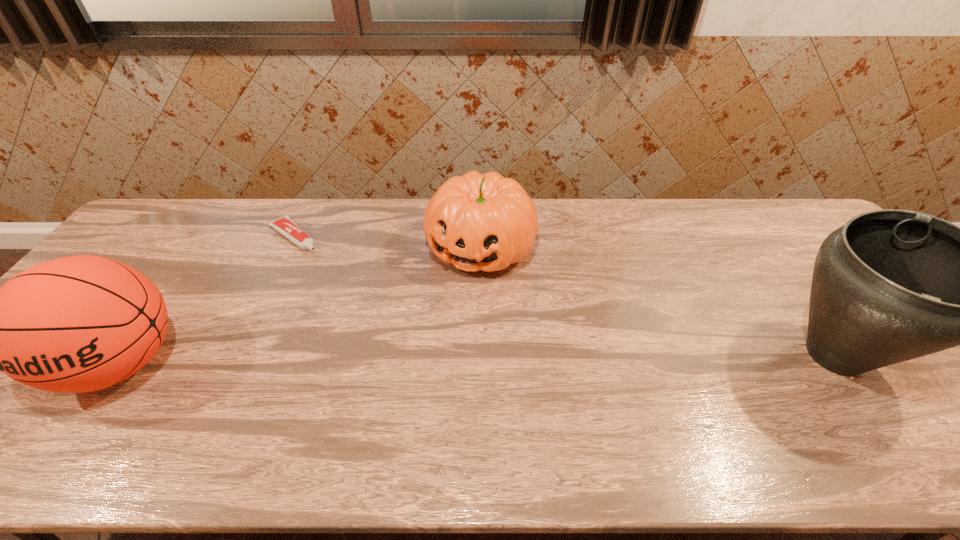
The height and width of the screenshot is (540, 960). I want to click on object that is at the near right corner, so click(891, 285).

In the image, there is a desktop. Identify the location of vacant space at the far edge. The image size is (960, 540). (301, 200).

This screenshot has height=540, width=960. In order to click on vacant region at the near edge of the desktop in this screenshot , I will do `click(280, 409)`.

Locate an element on the screen. The image size is (960, 540). vacant point located between the third object from left to right and the urn is located at coordinates (658, 301).

The image size is (960, 540). What are the coordinates of `vacant area that lies between the third tallest object and the rightmost object` in the screenshot? It's located at (658, 301).

Identify the location of empty space between the second object from right to left and the shortest object. The image size is (960, 540). (388, 242).

I want to click on vacant area that lies between the rightmost object and the leftmost object, so click(x=478, y=360).

At what (x,y) coordinates should I click in order to perform the action: click on free area in between the rightmost object and the leftmost object. Please return your answer as a coordinate pair (x, y). This screenshot has height=540, width=960. Looking at the image, I should click on (478, 360).

At what (x,y) coordinates should I click in order to perform the action: click on free spot between the second shortest object and the toothpaste. Please return your answer as a coordinate pair (x, y). The image size is (960, 540). Looking at the image, I should click on (388, 242).

Locate an element on the screen. The width and height of the screenshot is (960, 540). unoccupied position between the toothpaste and the third object from left to right is located at coordinates (388, 242).